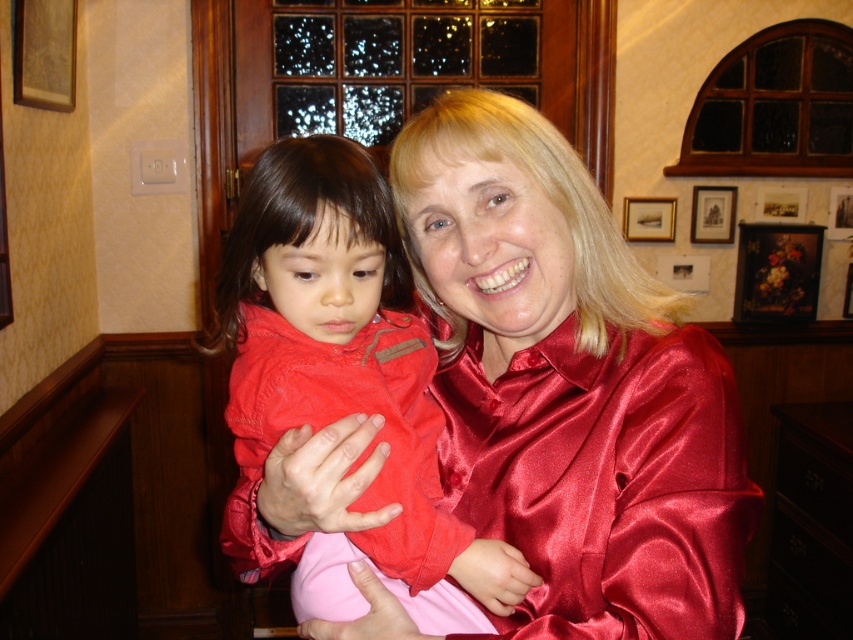
Based on the scene, can you determine if the satin red blouse at center is wider than the matte red jacket at center?

The satin red blouse at center is wider than the matte red jacket at center according to the description.

You are standing at the origin point in the image and want to move towards the point labeled as point (331,381). Is there another point, point (473,212), blocking your path?

Point (473,212) is behind point (331,381), so it is not blocking your path. You can move towards point (331,381) without any obstruction.

You are a photographer standing at the camera position. You want to adjust your position so that the distance between you and the satin red blouse at center becomes 30 inches. In which direction should you move?

The current distance between the camera and the satin red blouse at center is 26.94 inches. To increase the distance to 30 inches, you should move backward away from the satin red blouse at center by approximately 3.06 inches.